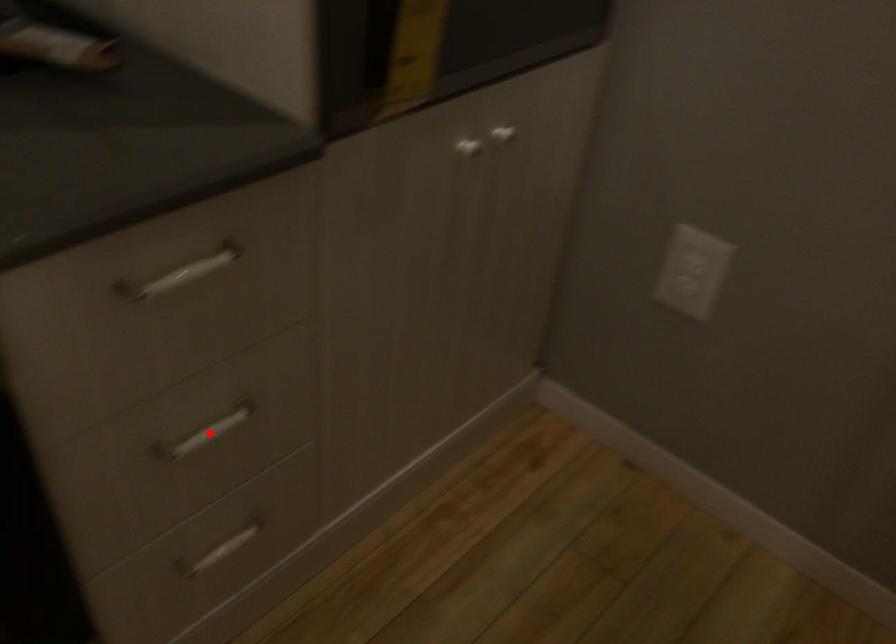
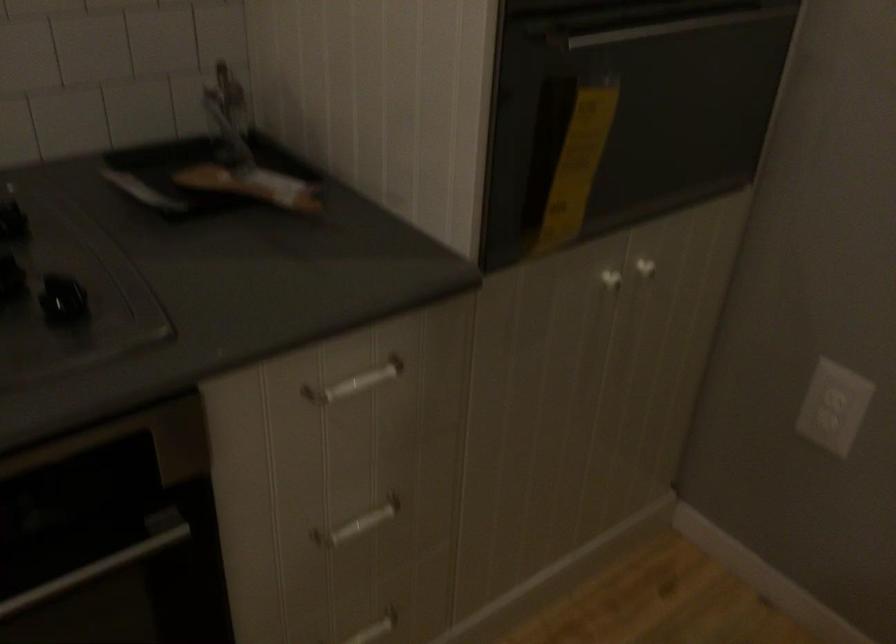
Question: I am providing you with two images of the same scene from different viewpoints. Given a red point in image1, look at the same physical point in image2. Is it:

Choices:
 (A) Closer to the viewpoint
 (B) Farther from the viewpoint

Answer: (B)